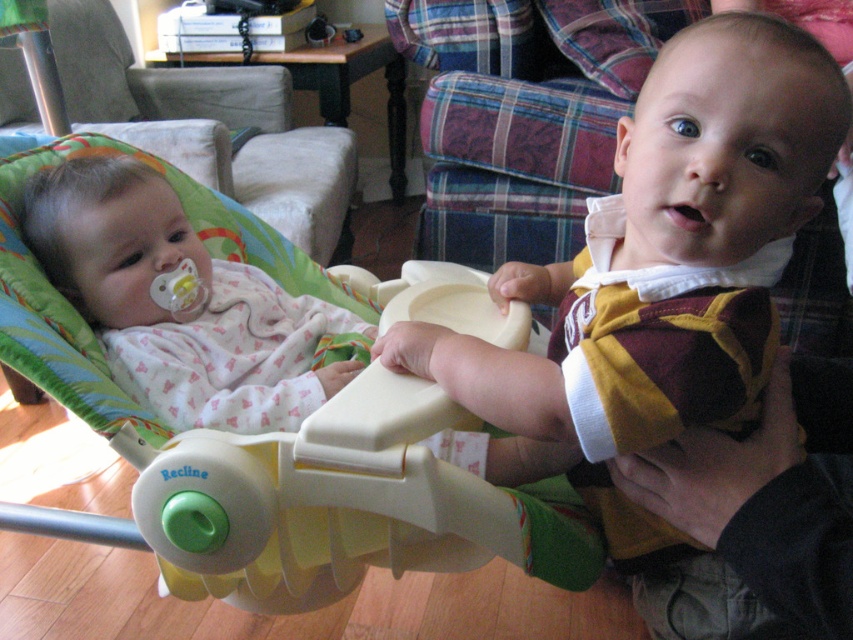
You are a parent who wants to place the white plastic baby carriage at left and the white soft baby at left into a storage closet. The closet has a shelf that can only hold items up to 50 cm in width. Which item should you place on the shelf first to ensure both fit?

The white soft baby at left has a smaller width than the white plastic baby carriage at left, so you should place the white soft baby at left first to ensure both items fit on the shelf.

You are a parent trying to locate your baby in the room. The room has a baby bouncer on the left and a baby being held on the right. You remember that the baby being held is exactly at point (601, 378). Can you confirm if the baby being held is on the right side of the room?

The maroon felt baby at center is located at point (601, 378). Since the baby being held is on the right side of the room, the coordinates confirm that the baby being held is indeed on the right side of the room.

You are a childcare worker who needs to dress both the maroon felt baby at center and the white soft baby at left. Which baby requires a larger size of clothing?

The maroon felt baby at center requires a larger size of clothing since it is bigger in size than the white soft baby at left.